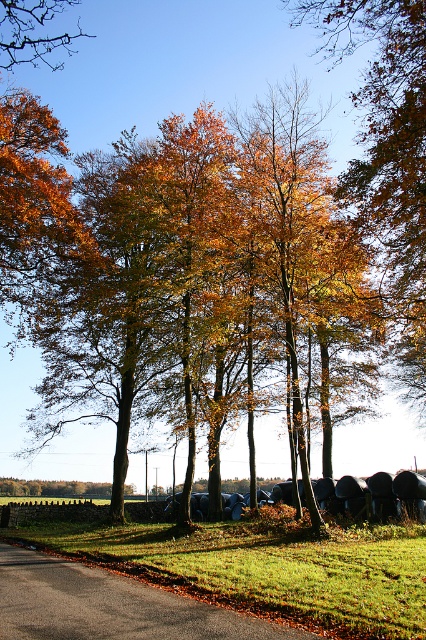
You are standing on the paved road in the scene and see the point marked at coordinates point (206, 289). Where is that point located?

The point (206, 289) is located on golden leaves at center.